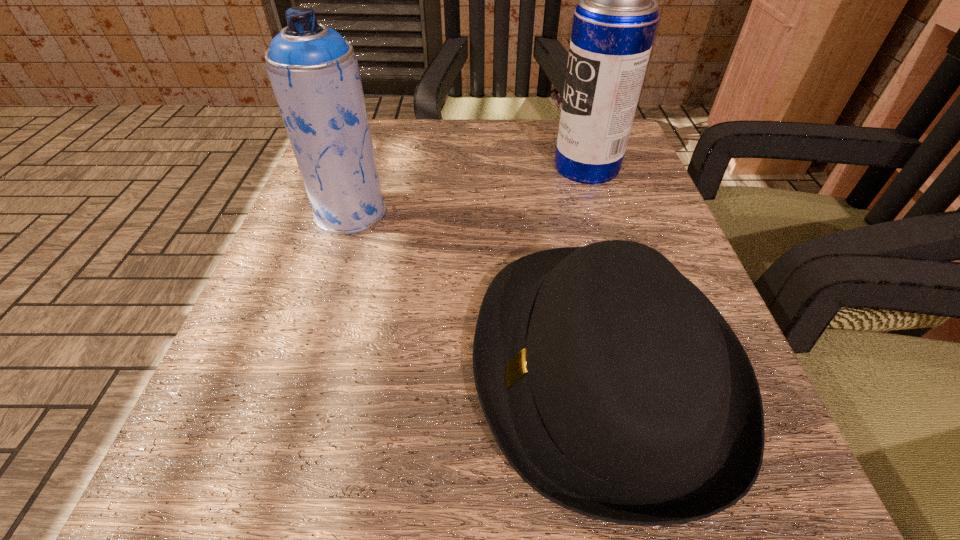
Where is `the farthest object`? This screenshot has width=960, height=540. the farthest object is located at coordinates (614, 25).

I want to click on the right aerosol can, so click(x=614, y=25).

Where is `the leftmost object`? Image resolution: width=960 pixels, height=540 pixels. the leftmost object is located at coordinates (313, 70).

Where is `the left aerosol can`? This screenshot has height=540, width=960. the left aerosol can is located at coordinates (313, 70).

Locate an element on the screen. This screenshot has height=540, width=960. fedora is located at coordinates tap(613, 386).

What are the coordinates of `the shortest object` in the screenshot? It's located at (613, 386).

Locate an element on the screen. Image resolution: width=960 pixels, height=540 pixels. vacant space situated on the label side of the farthest object is located at coordinates (514, 166).

This screenshot has height=540, width=960. What are the coordinates of `vacant space located 0.270m on the label side of the farthest object` in the screenshot? It's located at (418, 166).

Image resolution: width=960 pixels, height=540 pixels. I want to click on free space located on the label side of the farthest object, so click(448, 166).

This screenshot has width=960, height=540. Find the location of `vacant region located on the right of the leftmost object`. vacant region located on the right of the leftmost object is located at coordinates (581, 212).